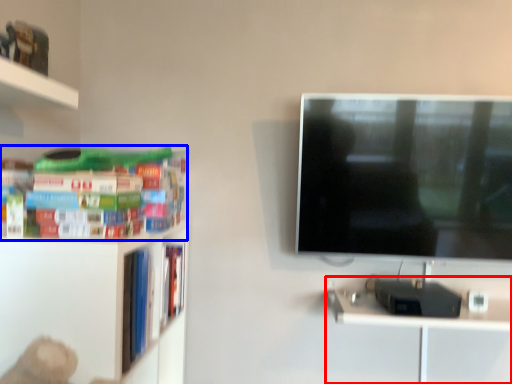
Question: Which object is closer to the camera taking this photo, computer desk (highlighted by a red box) or book (highlighted by a blue box)?

Choices:
 (A) computer desk
 (B) book

Answer: (B)